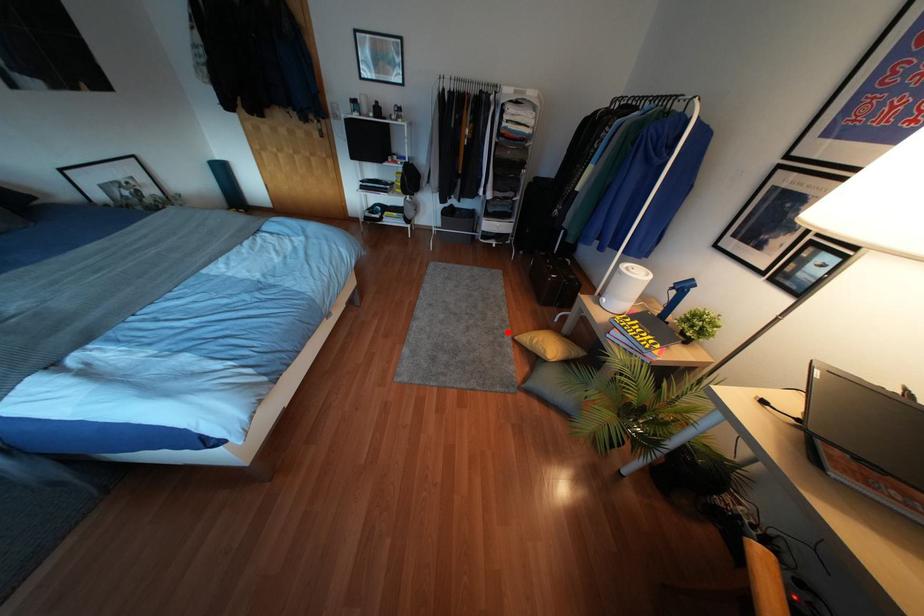
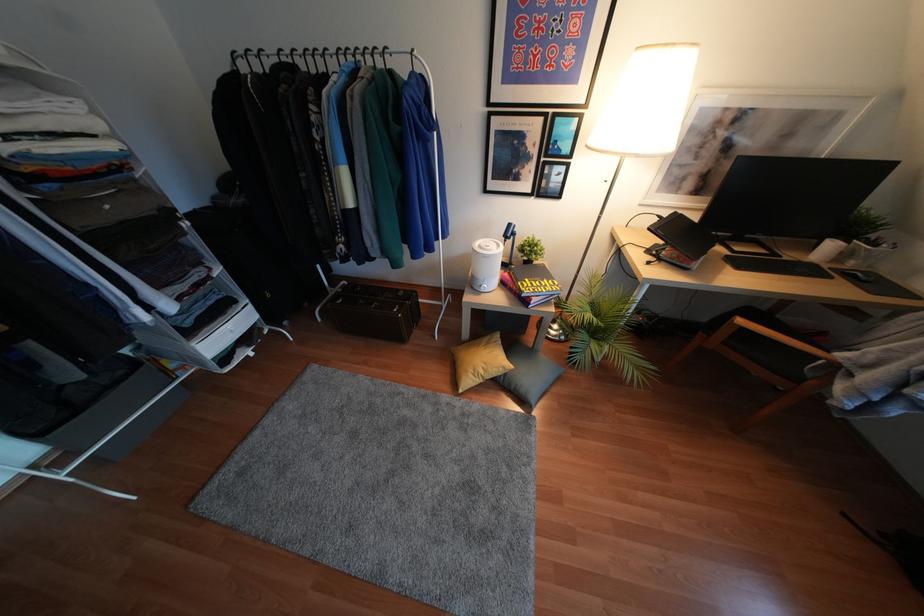
Question: I am providing you with two images of the same scene from different viewpoints. A red point is marked on the first image. At the location where the point appears in image 1, is it still visible in image 2?

Choices:
 (A) Yes
 (B) No

Answer: (A)